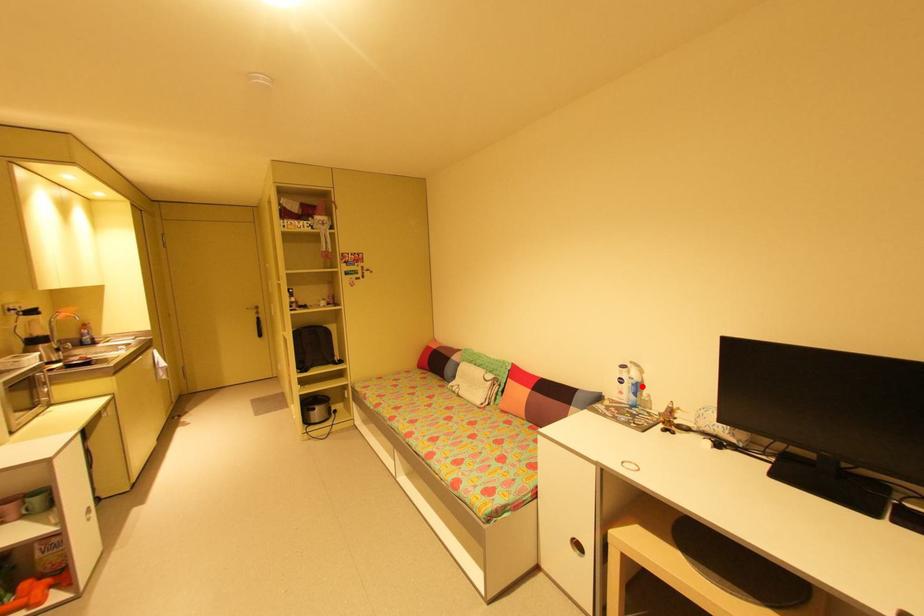
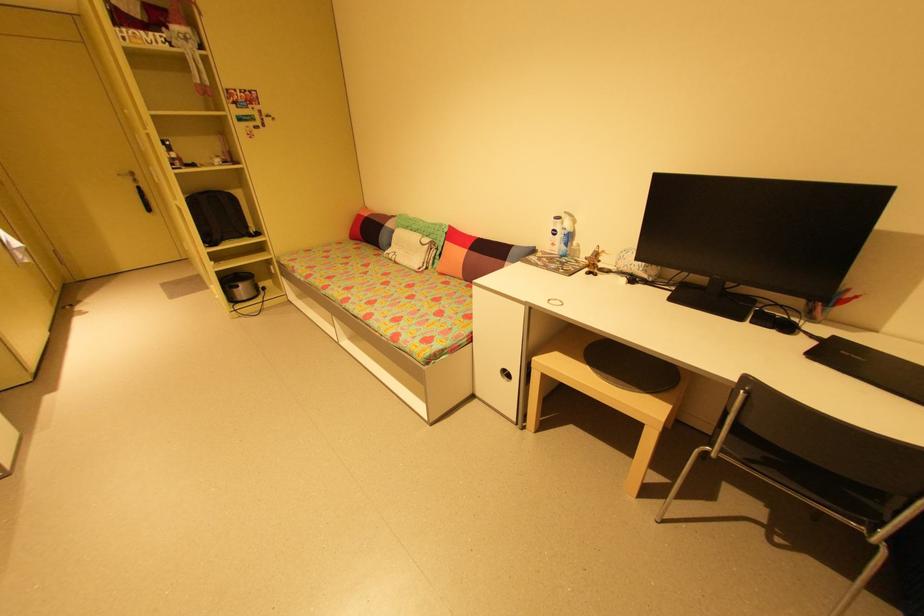
Where in the second image is the point corresponding to the highlighted location from the first image?

(574, 237)